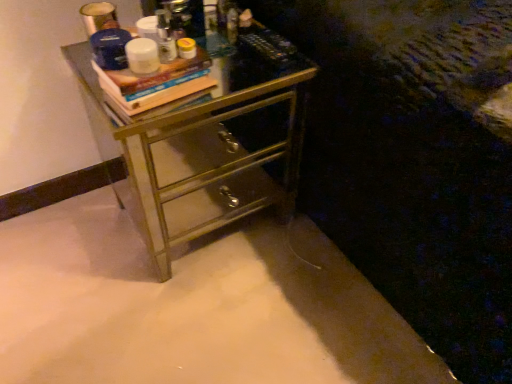
Locate an element on the screen. vacant area that is in front of metallic gold chest of drawers at center is located at coordinates (187, 318).